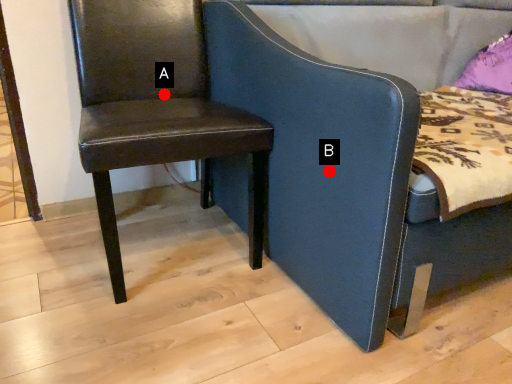
Question: Two points are circled on the image, labeled by A and B beside each circle. Which point appears farthest from the camera in this image?

Choices:
 (A) A is further
 (B) B is further

Answer: (A)